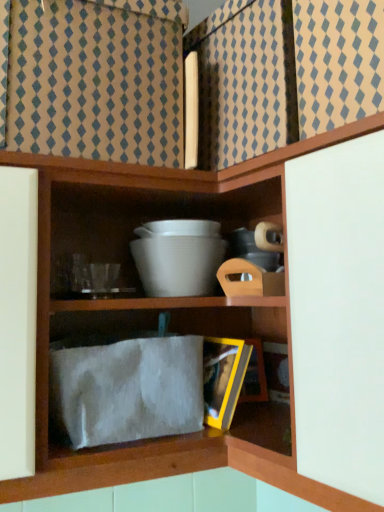
Question: Relative to white matte bowl at center, is white fuzzy cloth at lower center in front or behind?

Choices:
 (A) front
 (B) behind

Answer: (A)

Question: Based on their positions, is white fuzzy cloth at lower center located to the left or right of white matte bowl at center?

Choices:
 (A) right
 (B) left

Answer: (B)

Question: Do you think white fuzzy cloth at lower center is within white matte bowl at center, or outside of it?

Choices:
 (A) outside
 (B) inside

Answer: (A)

Question: From the image's perspective, relative to white fuzzy cloth at lower center, is white matte bowl at center above or below?

Choices:
 (A) below
 (B) above

Answer: (B)

Question: Looking at the image, does white matte bowl at center seem bigger or smaller compared to white fuzzy cloth at lower center?

Choices:
 (A) big
 (B) small

Answer: (B)

Question: Considering their positions, is white matte bowl at center located in front of or behind white fuzzy cloth at lower center?

Choices:
 (A) front
 (B) behind

Answer: (B)

Question: Visually, is white matte bowl at center positioned to the left or to the right of white fuzzy cloth at lower center?

Choices:
 (A) right
 (B) left

Answer: (A)